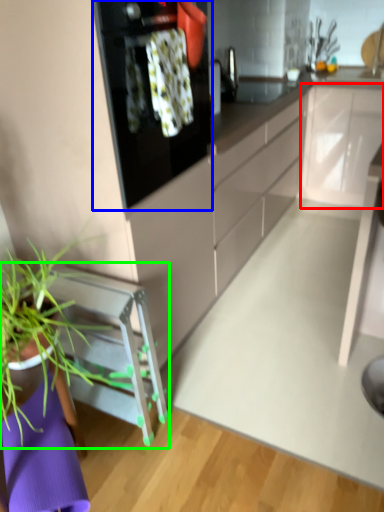
Question: Considering the real-world distances, which object is closest to cabinetry (highlighted by a red box)? kitchen appliance (highlighted by a blue box) or furniture (highlighted by a green box).

Choices:
 (A) kitchen appliance
 (B) furniture

Answer: (A)